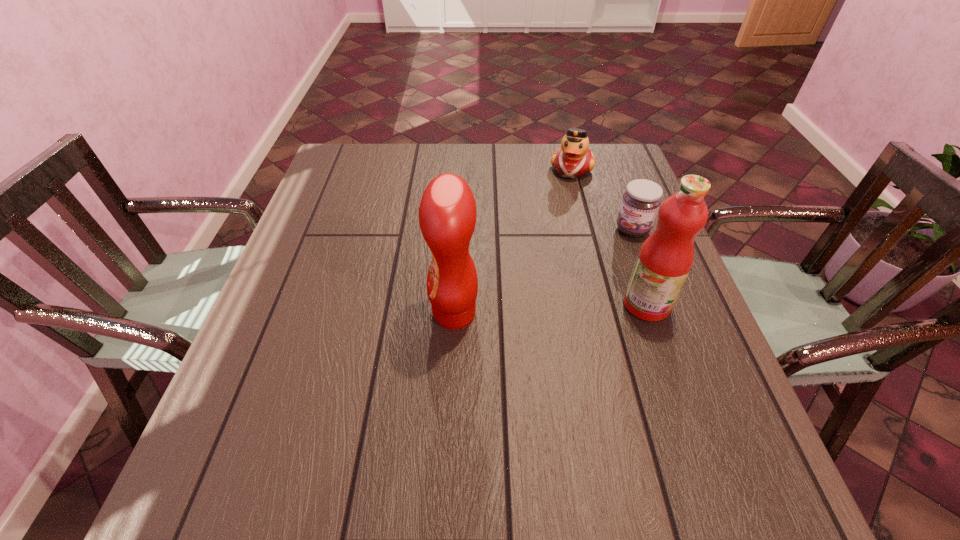
What are the coordinates of `vacant spot on the desktop that is between the leftmost object and the fruit juice and is positioned on the front label of the jam` in the screenshot? It's located at (559, 308).

Where is `free space on the desktop that is between the leftmost object and the fruit juice and is positioned on the face of the duck`? This screenshot has height=540, width=960. free space on the desktop that is between the leftmost object and the fruit juice and is positioned on the face of the duck is located at coordinates (539, 309).